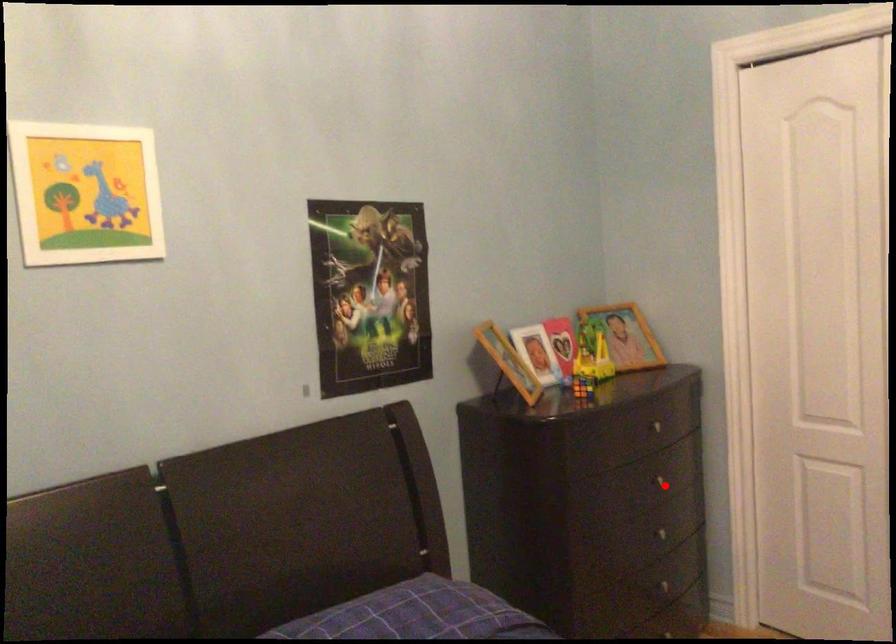
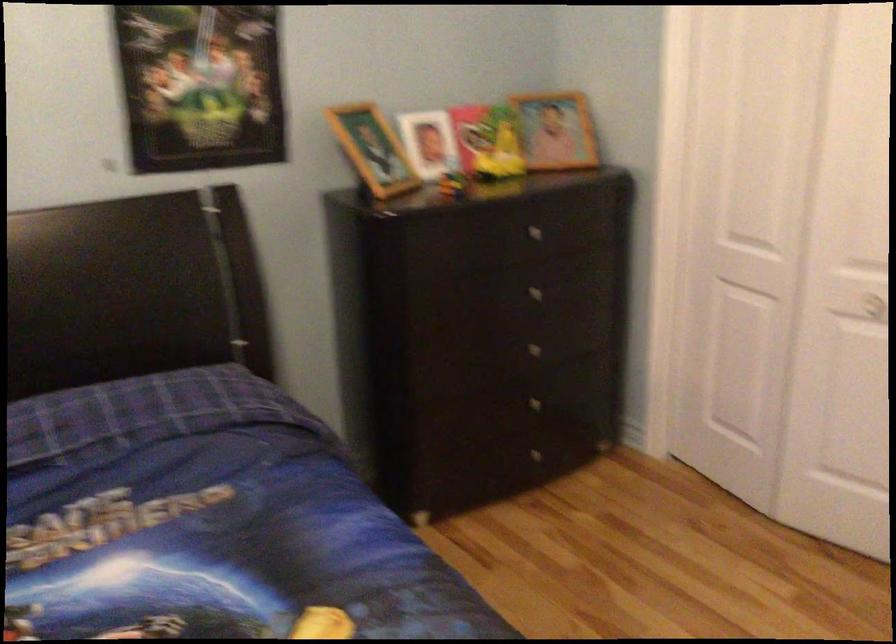
Where in the second image is the point corresponding to the highlighted location from the first image?

(538, 292)